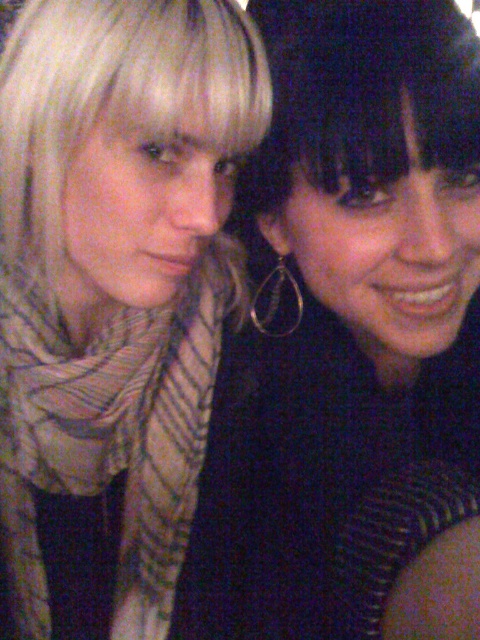
You are a photographer trying to adjust the lighting in the scene. You notice the striped scarf at left and the matte black top at center. Which object is positioned closer to the left side of the frame?

The striped scarf at left is positioned to the left of the matte black top at center, so it is closer to the left side of the frame.

In the scene shown: You are a photographer adjusting the lighting in a dimly lit room. You notice the striped scarf at left and the blondehair at left in the frame. Which object should you focus on to ensure proper exposure since it is taller?

The striped scarf at left is taller than the blondehair at left, so focusing on the striped scarf at left will ensure proper exposure for the taller object.

You are a photographer who needs to adjust the lighting to highlight both the matte black top at center and the blondehair at left. Since the scene is currently under low light, which object should you focus the light on first to ensure proper exposure, considering their positions?

The matte black top at center is positioned on the right side of blondehair at left. Since the matte black top at center is darker, it may require more light to avoid underexposure. Focus the light on the matte black top at center first to balance the exposure between both objects.